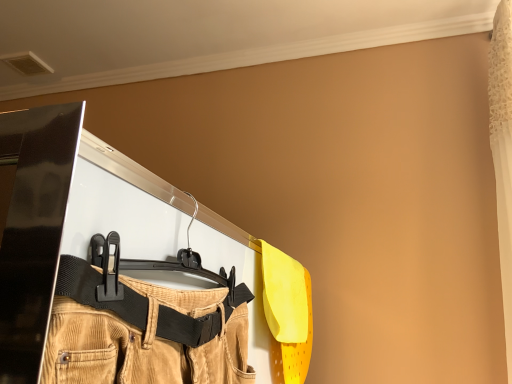
What do you see at coordinates (165, 262) in the screenshot? The height and width of the screenshot is (384, 512). I see `black plastic hanger at upper left` at bounding box center [165, 262].

What is the approximate height of black plastic hanger at upper left?

15.26 centimeters.

This screenshot has height=384, width=512. What are the coordinates of `black plastic hanger at upper left` in the screenshot? It's located at (165, 262).

I want to click on black plastic hanger at upper left, so click(165, 262).